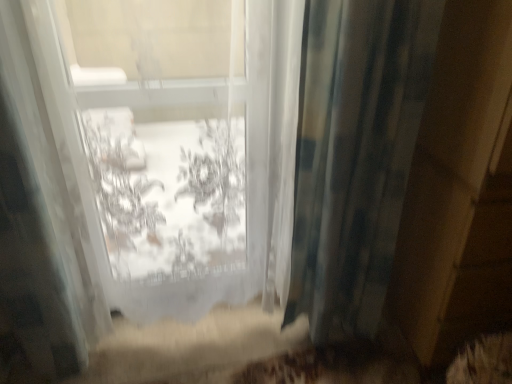
Question: Is blue textured curtain at right looking in the opposite direction of transparent fabric at center?

Choices:
 (A) no
 (B) yes

Answer: (A)

Question: From the image's perspective, is blue textured curtain at right beneath transparent fabric at center?

Choices:
 (A) no
 (B) yes

Answer: (B)

Question: Is blue textured curtain at right at the left side of transparent fabric at center?

Choices:
 (A) no
 (B) yes

Answer: (A)

Question: Can you confirm if blue textured curtain at right is wider than transparent fabric at center?

Choices:
 (A) no
 (B) yes

Answer: (A)

Question: Can you confirm if blue textured curtain at right is shorter than transparent fabric at center?

Choices:
 (A) yes
 (B) no

Answer: (A)

Question: From a real-world perspective, is blue textured curtain at right physically above transparent fabric at center?

Choices:
 (A) yes
 (B) no

Answer: (B)

Question: Is transparent fabric at center to the right of blue textured curtain at right from the viewer's perspective?

Choices:
 (A) yes
 (B) no

Answer: (B)

Question: Can you confirm if transparent fabric at center is thinner than blue textured curtain at right?

Choices:
 (A) no
 (B) yes

Answer: (A)

Question: Is transparent fabric at center smaller than blue textured curtain at right?

Choices:
 (A) yes
 (B) no

Answer: (B)

Question: From a real-world perspective, is transparent fabric at center over blue textured curtain at right?

Choices:
 (A) yes
 (B) no

Answer: (A)

Question: Is transparent fabric at center taller than blue textured curtain at right?

Choices:
 (A) no
 (B) yes

Answer: (B)

Question: From a real-world perspective, is transparent fabric at center located beneath blue textured curtain at right?

Choices:
 (A) no
 (B) yes

Answer: (A)

Question: In terms of size, does transparent fabric at center appear bigger or smaller than blue textured curtain at right?

Choices:
 (A) small
 (B) big

Answer: (B)